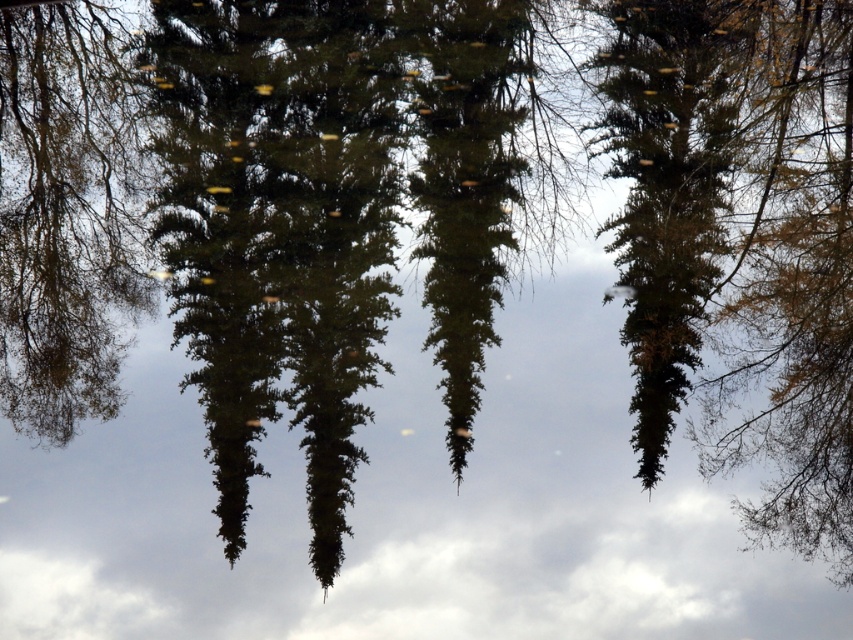
At what (x,y) coordinates should I click in order to perform the action: click on yellow-green needles at right. Please return your answer as a coordinate pair (x, y). The image size is (853, 640). Looking at the image, I should click on (793, 289).

Is yellow-green needles at right thinner than green matte tree at left?

Indeed, yellow-green needles at right has a lesser width compared to green matte tree at left.

What do you see at coordinates (793, 289) in the screenshot?
I see `yellow-green needles at right` at bounding box center [793, 289].

Find the location of a particular element. The image size is (853, 640). yellow-green needles at right is located at coordinates (793, 289).

Who is higher up, green matte tree at left or green matte tree at center?

green matte tree at left is above.

Which is behind, point (51, 42) or point (686, 99)?

Positioned behind is point (51, 42).

Where is `green matte tree at left`? green matte tree at left is located at coordinates (67, 212).

Can you confirm if yellow-green needles at right is bigger than green matte tree at center?

Yes.

Locate an element on the screen. Image resolution: width=853 pixels, height=640 pixels. yellow-green needles at right is located at coordinates (793, 289).

You are a GUI agent. You are given a task and a screenshot of the screen. Output one action in this format:
    pyautogui.click(x=<x>, y=<y>)
    Task: Click on the yellow-green needles at right
    The width and height of the screenshot is (853, 640).
    Given the screenshot: What is the action you would take?
    pyautogui.click(x=793, y=289)